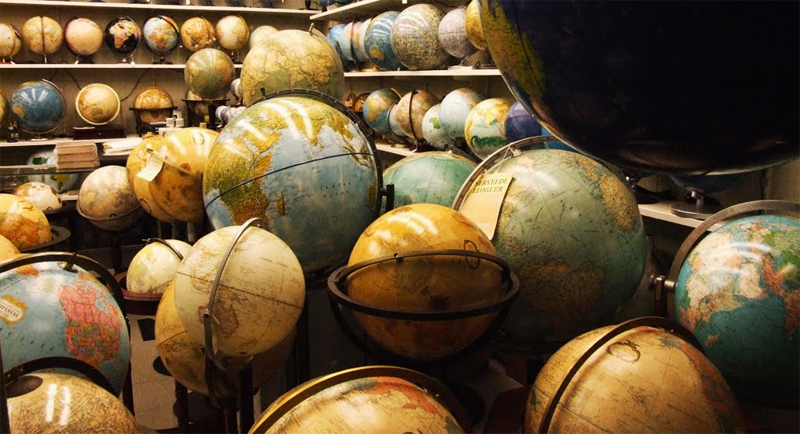
Where is `electrical cord`? electrical cord is located at coordinates (137, 85), (78, 85).